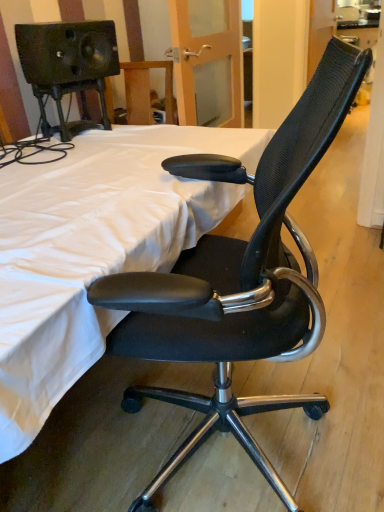
Based on the photo, what is the approximate height of white fabric bed at center?

33.87 inches.

In order to face white fabric bed at center, should I rotate leftwards or rightwards?

To face it directly, rotate left by 14.616 degrees.

Identify the location of white fabric bed at center. (93, 250).

This screenshot has width=384, height=512. What do you see at coordinates (93, 250) in the screenshot? I see `white fabric bed at center` at bounding box center [93, 250].

The height and width of the screenshot is (512, 384). Describe the element at coordinates (238, 280) in the screenshot. I see `black mesh office chair at center` at that location.

Find the location of a particular element. black mesh office chair at center is located at coordinates (238, 280).

In order to face black mesh office chair at center, should I rotate leftwards or rightwards?

To align with it, rotate right about 6.175°.

Locate an element on the screen. The image size is (384, 512). white fabric bed at center is located at coordinates pos(93,250).

Can you confirm if black mesh office chair at center is positioned to the left of white fabric bed at center?

No, black mesh office chair at center is not to the left of white fabric bed at center.

Which object is further away from the camera taking this photo, black mesh office chair at center or white fabric bed at center?

white fabric bed at center is further away from the camera.

Which is closer, (117, 301) or (139, 131)?

The point (117, 301) is closer to the camera.

From the image's perspective, which one is positioned lower, black mesh office chair at center or white fabric bed at center?

From the image's view, black mesh office chair at center is below.

Looking at this image, from a real-world perspective, which object rests below the other?

From a 3D spatial view, white fabric bed at center is below.

Can you confirm if black mesh office chair at center is thinner than white fabric bed at center?

Yes.

From their relative heights in the image, would you say black mesh office chair at center is taller or shorter than white fabric bed at center?

Considering their sizes, black mesh office chair at center has more height than white fabric bed at center.

Considering the sizes of black mesh office chair at center and white fabric bed at center in the image, is black mesh office chair at center bigger or smaller than white fabric bed at center?

black mesh office chair at center is smaller than white fabric bed at center.

Which is correct: black mesh office chair at center is inside white fabric bed at center, or outside of it?

black mesh office chair at center is located beyond the bounds of white fabric bed at center.

Are black mesh office chair at center and white fabric bed at center located far from each other?

black mesh office chair at center is actually quite close to white fabric bed at center.

Is black mesh office chair at center aimed at white fabric bed at center?

Yes, black mesh office chair at center is facing white fabric bed at center.

In the scene shown: How many degrees apart are the facing directions of black mesh office chair at center and white fabric bed at center?

164 degrees.

Locate an element on the screen. This screenshot has height=512, width=384. bed that appears below the black mesh office chair at center (from a real-world perspective) is located at coordinates (93, 250).

Considering the relative positions of white fabric bed at center and black mesh office chair at center in the image provided, is white fabric bed at center to the left or to the right of black mesh office chair at center?

Based on their positions, white fabric bed at center is located to the left of black mesh office chair at center.

Considering the positions of objects white fabric bed at center and black mesh office chair at center in the image provided, who is behind, white fabric bed at center or black mesh office chair at center?

white fabric bed at center.

Does point (24, 341) come in front of point (255, 444)?

That is True.

From the image's perspective, between white fabric bed at center and black mesh office chair at center, who is located below?

black mesh office chair at center is shown below in the image.

From a real-world perspective, between white fabric bed at center and black mesh office chair at center, who is vertically lower?

white fabric bed at center is physically lower.

Which of these two, white fabric bed at center or black mesh office chair at center, is thinner?

black mesh office chair at center is thinner.

Who is shorter, white fabric bed at center or black mesh office chair at center?

white fabric bed at center is shorter.

Between white fabric bed at center and black mesh office chair at center, which one has larger size?

white fabric bed at center is bigger.

Is white fabric bed at center outside of black mesh office chair at center?

Yes, white fabric bed at center is located beyond the bounds of black mesh office chair at center.

Is white fabric bed at center not near black mesh office chair at center?

No, white fabric bed at center is not far from black mesh office chair at center.

Does white fabric bed at center turn towards black mesh office chair at center?

Yes, white fabric bed at center is facing black mesh office chair at center.

From the picture: Can you tell me how much white fabric bed at center and black mesh office chair at center differ in facing direction?

The angle between the facing direction of white fabric bed at center and the facing direction of black mesh office chair at center is 164 degrees.

You are a GUI agent. You are given a task and a screenshot of the screen. Output one action in this format:
    pyautogui.click(x=<x>, y=<y>)
    Task: Click on the chair that is below the white fabric bed at center (from the image's perspective)
    The image size is (384, 512).
    Given the screenshot: What is the action you would take?
    [238, 280]

Identify the location of bed that appears above the black mesh office chair at center (from the image's perspective). The image size is (384, 512). click(93, 250).

Find the location of a particular element. The image size is (384, 512). chair lying on the right of white fabric bed at center is located at coordinates (238, 280).